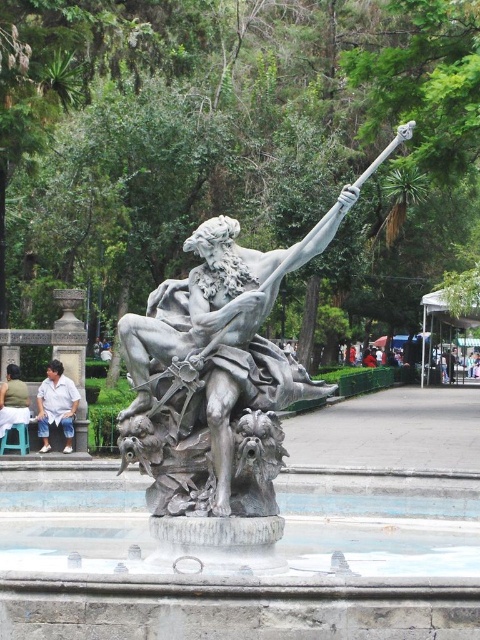
Question: Which object is positioned farthest from the bronze statue at center?

Choices:
 (A) light brown fabric shirt at center
 (B) light blue jeans at lower left

Answer: (B)

Question: Among these objects, which one is nearest to the camera?

Choices:
 (A) light blue jeans at lower left
 (B) light brown fabric shirt at center
 (C) bronze statue at center

Answer: (C)

Question: Among these points, which one is farthest from the camera?

Choices:
 (A) (216, 353)
 (B) (64, 387)
 (C) (7, 385)

Answer: (C)

Question: Observing the image, what is the correct spatial positioning of light blue jeans at lower left in reference to light brown fabric shirt at center?

Choices:
 (A) below
 (B) above

Answer: (B)

Question: Is bronze statue at center to the left of light blue jeans at lower left from the viewer's perspective?

Choices:
 (A) yes
 (B) no

Answer: (B)

Question: Is light blue jeans at lower left to the left of light brown fabric shirt at center from the viewer's perspective?

Choices:
 (A) yes
 (B) no

Answer: (B)